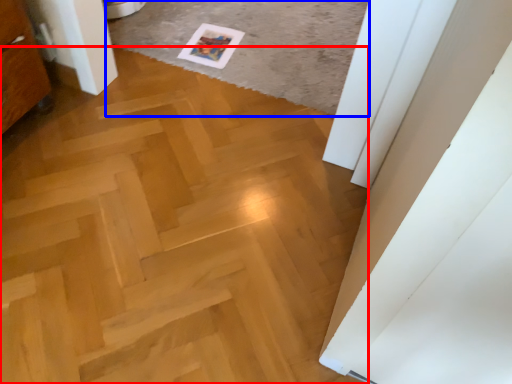
Question: Which object is further to the camera taking this photo, plywood (highlighted by a red box) or plain (highlighted by a blue box)?

Choices:
 (A) plywood
 (B) plain

Answer: (B)